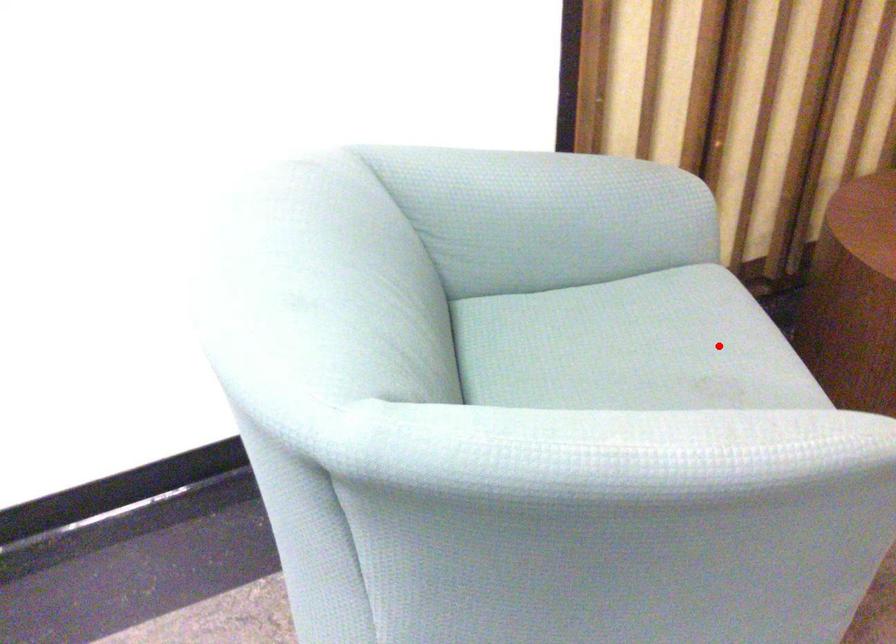
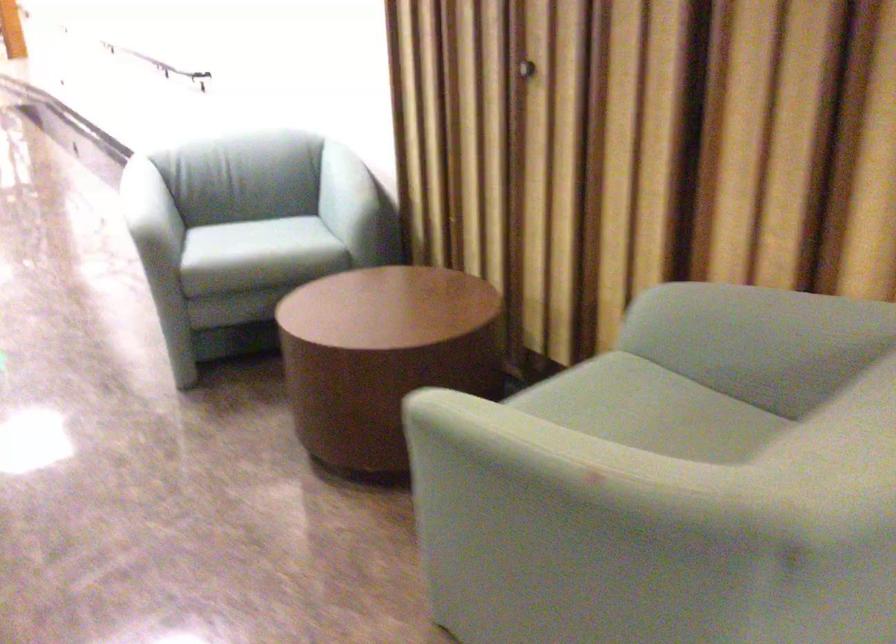
Question: I am providing you with two images of the same scene from different viewpoints. A red point is shown in image1. For the corresponding object point in image2, is it positioned nearer or farther from the camera?

Choices:
 (A) Nearer
 (B) Farther

Answer: (B)